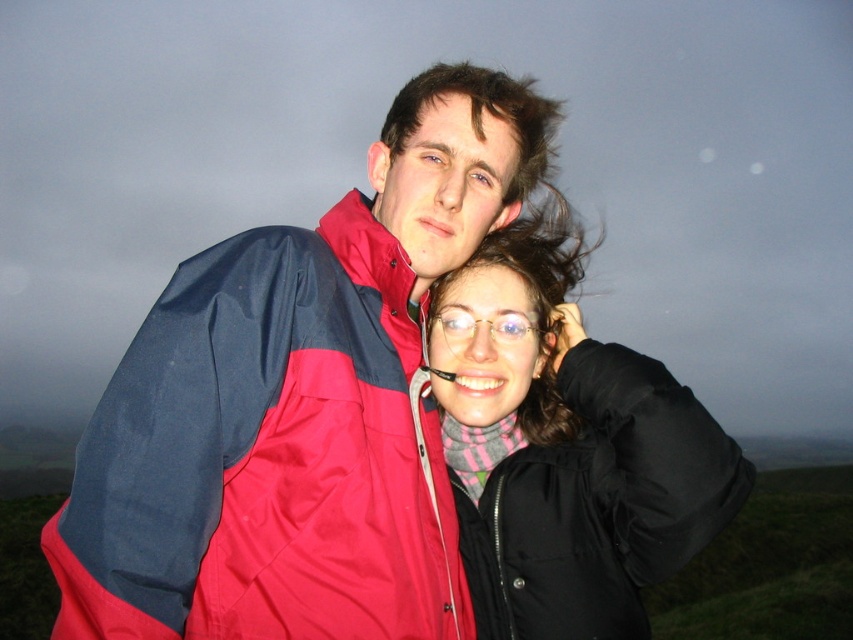
Based on the photo, can you confirm if red nylon jacket at center is positioned below black matte jacket at center?

Correct, red nylon jacket at center is located below black matte jacket at center.

Does red nylon jacket at center have a lesser height compared to black matte jacket at center?

Indeed, red nylon jacket at center has a lesser height compared to black matte jacket at center.

Identify the location of red nylon jacket at center. (265, 456).